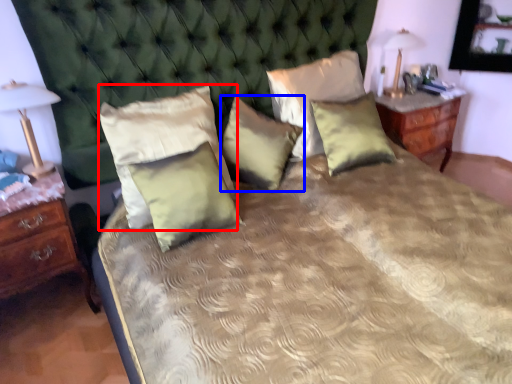
Question: Among these objects, which one is farthest to the camera, pillow (highlighted by a red box) or pillow (highlighted by a blue box)?

Choices:
 (A) pillow
 (B) pillow

Answer: (B)